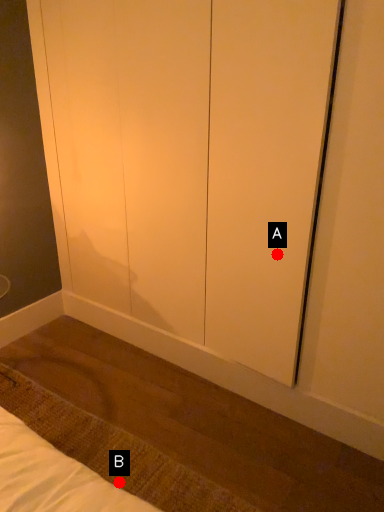
Question: Two points are circled on the image, labeled by A and B beside each circle. Which point appears closest to the camera in this image?

Choices:
 (A) A is closer
 (B) B is closer

Answer: (B)